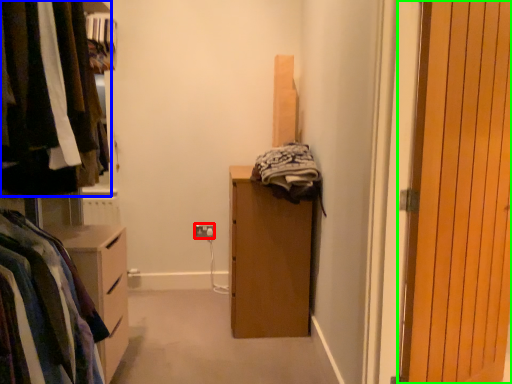
Question: Which object is positioned farthest from electric outlet (highlighted by a red box)? Select from closet (highlighted by a blue box) and door (highlighted by a green box).

Choices:
 (A) closet
 (B) door

Answer: (B)